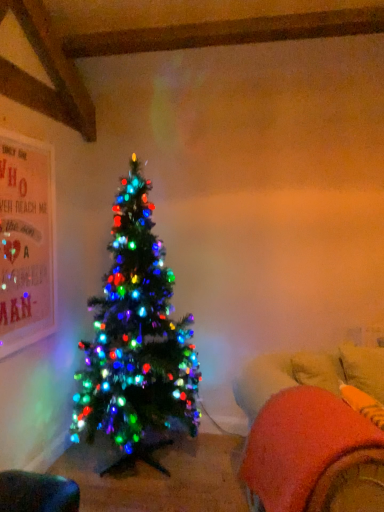
Where is `fluffy orange bean bag at lower right, placed as the 1th bean bag chair when sorted from right to left`? fluffy orange bean bag at lower right, placed as the 1th bean bag chair when sorted from right to left is located at coordinates (312, 432).

What do you see at coordinates (312, 432) in the screenshot? The height and width of the screenshot is (512, 384). I see `fluffy orange bean bag at lower right, acting as the second bean bag chair starting from the bottom` at bounding box center [312, 432].

What do you see at coordinates (37, 492) in the screenshot? I see `velvet orange bean bag chair at lower left, the second bean bag chair positioned from the right` at bounding box center [37, 492].

Locate an element on the screen. velvet orange bean bag chair at lower left, the second bean bag chair positioned from the right is located at coordinates (37, 492).

Where is `fluffy orange bean bag at lower right, acting as the second bean bag chair starting from the bottom`? fluffy orange bean bag at lower right, acting as the second bean bag chair starting from the bottom is located at coordinates (312, 432).

Is velvet orange bean bag chair at lower left, the 2th bean bag chair in the top-to-bottom sequence, to the left or to the right of fluffy orange bean bag at lower right, placed as the 1th bean bag chair when sorted from right to left, in the image?

From the image, it's evident that velvet orange bean bag chair at lower left, the 2th bean bag chair in the top-to-bottom sequence, is to the left of fluffy orange bean bag at lower right, placed as the 1th bean bag chair when sorted from right to left.

Which object is closer to the camera, velvet orange bean bag chair at lower left, the first bean bag chair positioned from the left, or fluffy orange bean bag at lower right, acting as the 2th bean bag chair starting from the left?

fluffy orange bean bag at lower right, acting as the 2th bean bag chair starting from the left, is more forward.

Which is behind, point (33, 477) or point (322, 412)?

The point (33, 477) is farther.

From the image's perspective, relative to fluffy orange bean bag at lower right, acting as the second bean bag chair starting from the bottom, is velvet orange bean bag chair at lower left, the 2th bean bag chair in the top-to-bottom sequence, above or below?

velvet orange bean bag chair at lower left, the 2th bean bag chair in the top-to-bottom sequence, is below fluffy orange bean bag at lower right, acting as the second bean bag chair starting from the bottom.

From a real-world perspective, is velvet orange bean bag chair at lower left, the first bean bag chair positioned from the left, located higher than fluffy orange bean bag at lower right, acting as the second bean bag chair starting from the bottom?

No, from a real-world perspective, velvet orange bean bag chair at lower left, the first bean bag chair positioned from the left, is not above fluffy orange bean bag at lower right, acting as the second bean bag chair starting from the bottom.

Can you confirm if velvet orange bean bag chair at lower left, the 2th bean bag chair in the top-to-bottom sequence, is thinner than fluffy orange bean bag at lower right, arranged as the 1th bean bag chair when viewed from the top?

No.

Considering the relative sizes of velvet orange bean bag chair at lower left, the first bean bag chair positioned from the left, and fluffy orange bean bag at lower right, acting as the 2th bean bag chair starting from the left, in the image provided, is velvet orange bean bag chair at lower left, the first bean bag chair positioned from the left, shorter than fluffy orange bean bag at lower right, acting as the 2th bean bag chair starting from the left,?

Yes, velvet orange bean bag chair at lower left, the first bean bag chair positioned from the left, is shorter than fluffy orange bean bag at lower right, acting as the 2th bean bag chair starting from the left.

Looking at the image, does velvet orange bean bag chair at lower left, the second bean bag chair positioned from the right, seem bigger or smaller compared to fluffy orange bean bag at lower right, acting as the second bean bag chair starting from the bottom?

Considering their sizes, velvet orange bean bag chair at lower left, the second bean bag chair positioned from the right, takes up less space than fluffy orange bean bag at lower right, acting as the second bean bag chair starting from the bottom.

Is velvet orange bean bag chair at lower left, the first bean bag chair positioned from the left, located outside fluffy orange bean bag at lower right, acting as the 2th bean bag chair starting from the left?

Absolutely, velvet orange bean bag chair at lower left, the first bean bag chair positioned from the left, is external to fluffy orange bean bag at lower right, acting as the 2th bean bag chair starting from the left.

Is velvet orange bean bag chair at lower left, marked as the first bean bag chair in a bottom-to-top arrangement, directly adjacent to fluffy orange bean bag at lower right, acting as the 2th bean bag chair starting from the left?

velvet orange bean bag chair at lower left, marked as the first bean bag chair in a bottom-to-top arrangement, and fluffy orange bean bag at lower right, acting as the 2th bean bag chair starting from the left, are clearly separated.

Is velvet orange bean bag chair at lower left, the 2th bean bag chair in the top-to-bottom sequence, looking in the opposite direction of fluffy orange bean bag at lower right, acting as the second bean bag chair starting from the bottom?

No, velvet orange bean bag chair at lower left, the 2th bean bag chair in the top-to-bottom sequence, is not facing the opposite direction of fluffy orange bean bag at lower right, acting as the second bean bag chair starting from the bottom.

Where is `bean bag chair below the fluffy orange bean bag at lower right, arranged as the 1th bean bag chair when viewed from the top (from a real-world perspective)`? This screenshot has width=384, height=512. bean bag chair below the fluffy orange bean bag at lower right, arranged as the 1th bean bag chair when viewed from the top (from a real-world perspective) is located at coordinates (37, 492).

Can you confirm if fluffy orange bean bag at lower right, acting as the 2th bean bag chair starting from the left, is positioned to the right of velvet orange bean bag chair at lower left, the first bean bag chair positioned from the left?

Yes.

Who is more distant, fluffy orange bean bag at lower right, arranged as the 1th bean bag chair when viewed from the top, or velvet orange bean bag chair at lower left, marked as the first bean bag chair in a bottom-to-top arrangement?

velvet orange bean bag chair at lower left, marked as the first bean bag chair in a bottom-to-top arrangement, is more distant.

Is point (333, 394) positioned after point (72, 490)?

No, it is not.

From the image's perspective, between fluffy orange bean bag at lower right, arranged as the 1th bean bag chair when viewed from the top, and velvet orange bean bag chair at lower left, the second bean bag chair positioned from the right, who is located below?

From the image's view, velvet orange bean bag chair at lower left, the second bean bag chair positioned from the right, is below.

From a real-world perspective, relative to velvet orange bean bag chair at lower left, the 2th bean bag chair in the top-to-bottom sequence, is fluffy orange bean bag at lower right, acting as the 2th bean bag chair starting from the left, vertically above or below?

fluffy orange bean bag at lower right, acting as the 2th bean bag chair starting from the left, is situated higher than velvet orange bean bag chair at lower left, the 2th bean bag chair in the top-to-bottom sequence, in the real world.

Considering the relative sizes of fluffy orange bean bag at lower right, placed as the 1th bean bag chair when sorted from right to left, and velvet orange bean bag chair at lower left, the second bean bag chair positioned from the right, in the image provided, is fluffy orange bean bag at lower right, placed as the 1th bean bag chair when sorted from right to left, thinner than velvet orange bean bag chair at lower left, the second bean bag chair positioned from the right,?

Yes.

Can you confirm if fluffy orange bean bag at lower right, placed as the 1th bean bag chair when sorted from right to left, is shorter than velvet orange bean bag chair at lower left, the first bean bag chair positioned from the left?

In fact, fluffy orange bean bag at lower right, placed as the 1th bean bag chair when sorted from right to left, may be taller than velvet orange bean bag chair at lower left, the first bean bag chair positioned from the left.

Can you confirm if fluffy orange bean bag at lower right, arranged as the 1th bean bag chair when viewed from the top, is bigger than velvet orange bean bag chair at lower left, the first bean bag chair positioned from the left?

Indeed, fluffy orange bean bag at lower right, arranged as the 1th bean bag chair when viewed from the top, has a larger size compared to velvet orange bean bag chair at lower left, the first bean bag chair positioned from the left.

Is velvet orange bean bag chair at lower left, marked as the first bean bag chair in a bottom-to-top arrangement, a part of fluffy orange bean bag at lower right, acting as the second bean bag chair starting from the bottom?

No, fluffy orange bean bag at lower right, acting as the second bean bag chair starting from the bottom, does not contain velvet orange bean bag chair at lower left, marked as the first bean bag chair in a bottom-to-top arrangement.

Consider the image. Are fluffy orange bean bag at lower right, arranged as the 1th bean bag chair when viewed from the top, and velvet orange bean bag chair at lower left, the second bean bag chair positioned from the right, beside each other?

fluffy orange bean bag at lower right, arranged as the 1th bean bag chair when viewed from the top, is not next to velvet orange bean bag chair at lower left, the second bean bag chair positioned from the right, and they're not touching.

Is fluffy orange bean bag at lower right, placed as the 1th bean bag chair when sorted from right to left, oriented away from velvet orange bean bag chair at lower left, the first bean bag chair positioned from the left?

No, fluffy orange bean bag at lower right, placed as the 1th bean bag chair when sorted from right to left, is not facing away from velvet orange bean bag chair at lower left, the first bean bag chair positioned from the left.

Could you measure the distance between fluffy orange bean bag at lower right, arranged as the 1th bean bag chair when viewed from the top, and velvet orange bean bag chair at lower left, the second bean bag chair positioned from the right?

fluffy orange bean bag at lower right, arranged as the 1th bean bag chair when viewed from the top, is 37.42 inches from velvet orange bean bag chair at lower left, the second bean bag chair positioned from the right.

Where is `bean bag chair above the velvet orange bean bag chair at lower left, the second bean bag chair positioned from the right (from the image's perspective)`? bean bag chair above the velvet orange bean bag chair at lower left, the second bean bag chair positioned from the right (from the image's perspective) is located at coordinates (312, 432).

The width and height of the screenshot is (384, 512). In order to click on bean bag chair in front of the velvet orange bean bag chair at lower left, the first bean bag chair positioned from the left in this screenshot , I will do `click(312, 432)`.

The width and height of the screenshot is (384, 512). I want to click on bean bag chair above the velvet orange bean bag chair at lower left, the 2th bean bag chair in the top-to-bottom sequence (from the image's perspective), so click(x=312, y=432).